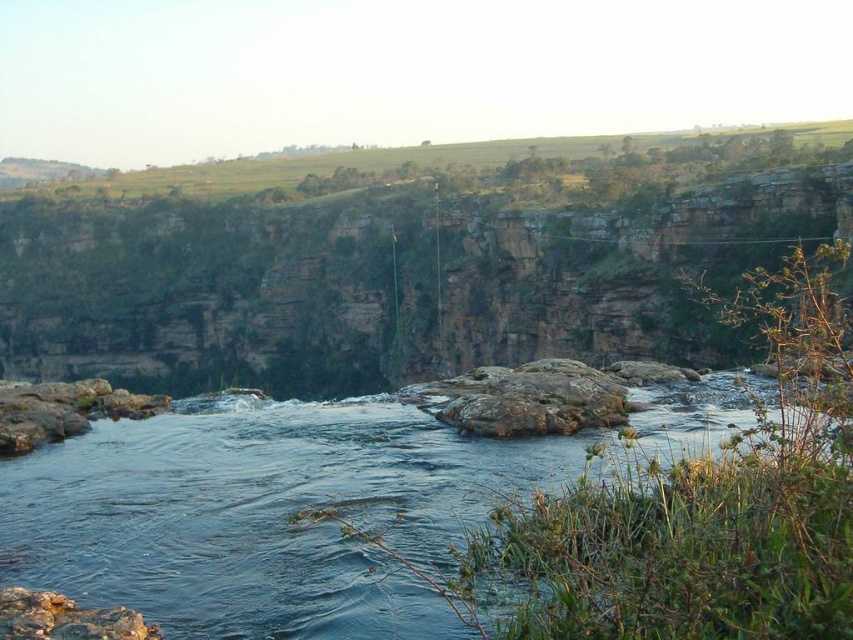
You are a hiker who wants to cross the river using the rocks in the foreground. You need to step on the smooth gray rock at lower left and the rusty stone at lower left. Which rock should you step on first if you want to reach the higher elevation?

The smooth gray rock at lower left is taller than the rusty stone at lower left, so you should step on the smooth gray rock at lower left first to reach higher elevation.

You are a geologist examining the rocks at the base of the cliff. You have a measuring tape and want to compare the sizes of the smooth gray rock at lower left and the rusty stone at lower left. Which rock do you think is wider?

The smooth gray rock at lower left is wider than the rusty stone at lower left because its width is larger according to the description.

You are standing at the edge of the cliff and want to find the clear water at center to fill your water bottle. According to the coordinates provided, where should you look relative to your position?

The clear water at center is located at coordinates point (x=196, y=484), which means it is positioned to the right and slightly below your current position at the cliff edge.